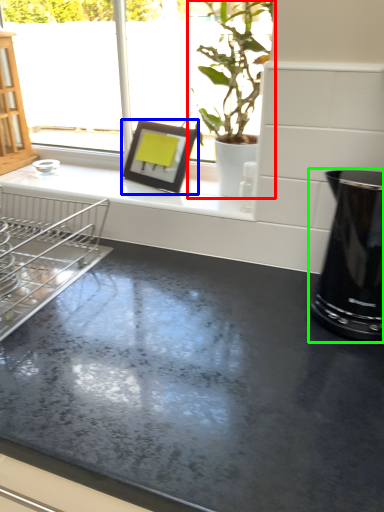
Question: Based on their relative distances, which object is nearer to houseplant (highlighted by a red box)? Choose from picture frame (highlighted by a blue box) and appliance (highlighted by a green box).

Choices:
 (A) picture frame
 (B) appliance

Answer: (A)